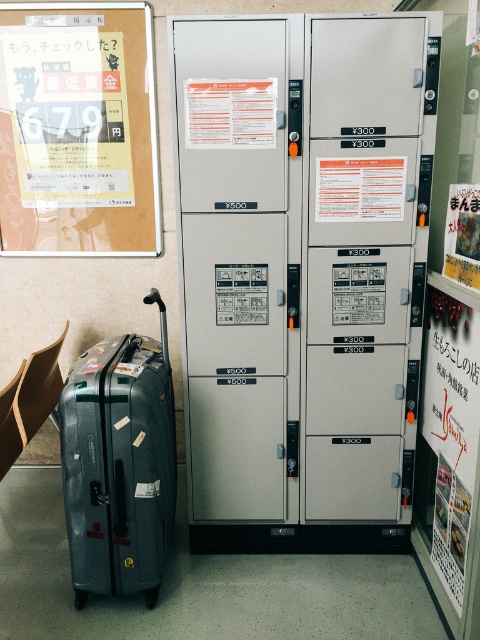
You are standing in the public space shown in the image. You need to locate the white paper poster at center. Can you tell me its exact coordinates?

The white paper poster at center is located at coordinates point (360, 188).

You are a traveler who needs to store your luggage temporarily. You see the satin silver locker at center and the matte paper poster at right. Which object is taller?

The satin silver locker at center is much taller than the matte paper poster at right.